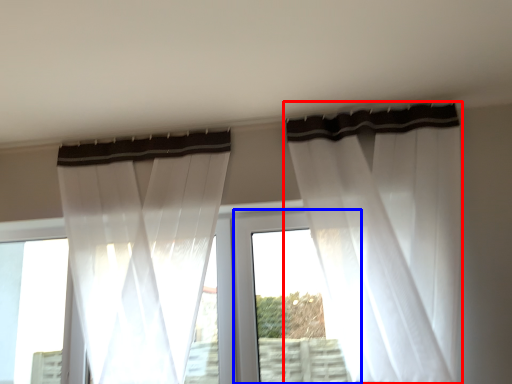
Question: Among these objects, which one is nearest to the camera, curtain (highlighted by a red box) or window frame (highlighted by a blue box)?

Choices:
 (A) curtain
 (B) window frame

Answer: (A)